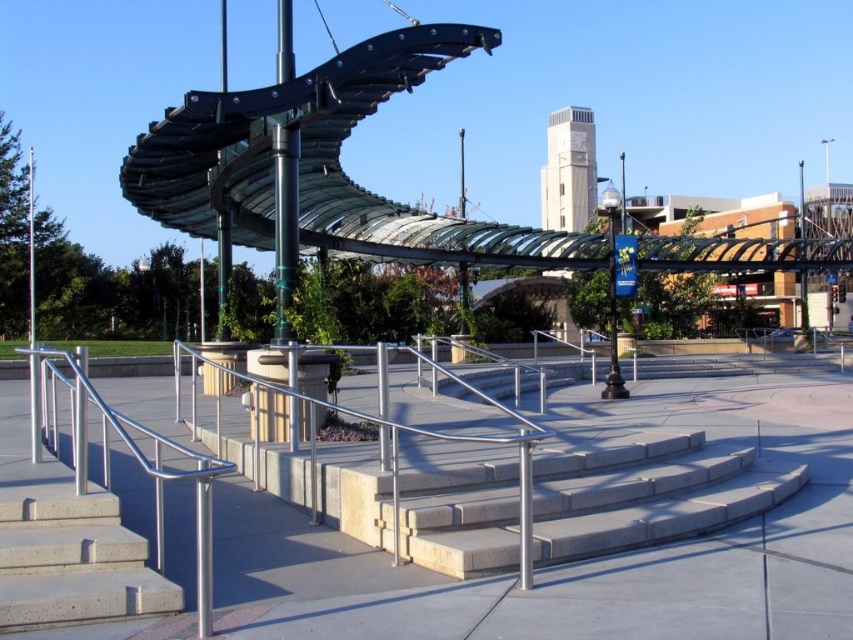
You are standing at the entrance of the plaza and want to reach the raised platform. The entrance is located at point 0.0. Which direction should you walk to find the light gray concrete stairs at center?

Since the light gray concrete stairs at center are located at point (647, 493), you should walk forward from the entrance at point 0.0 to reach them.